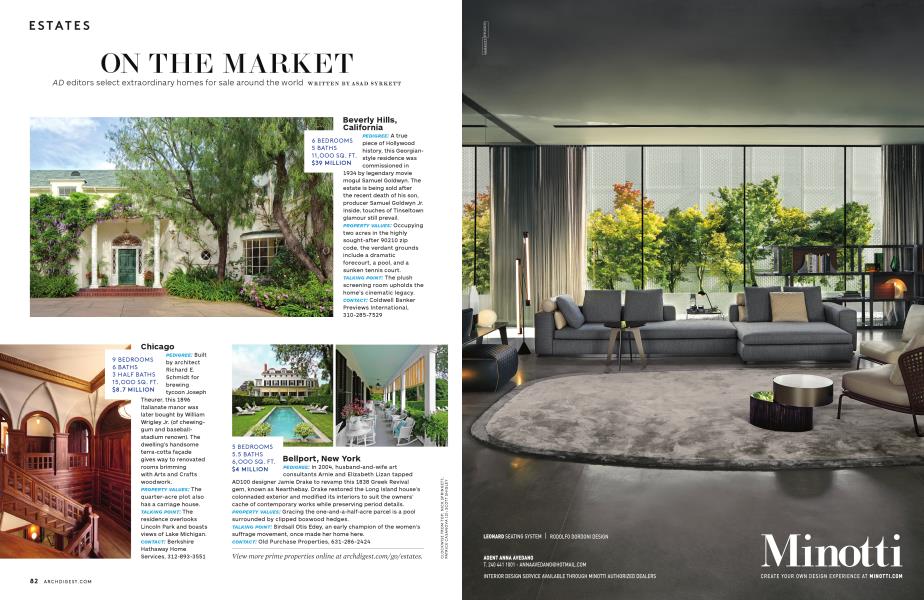
Where is `wooden handrail on staircase`? This screenshot has height=600, width=924. wooden handrail on staircase is located at coordinates (74, 543), (46, 486).